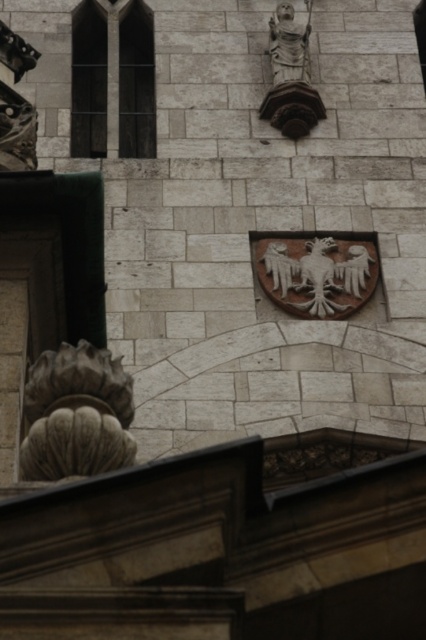
Consider the image. Between carved stone ornament at left and stone statue at upper center, which one is positioned lower?

Positioned lower is carved stone ornament at left.

Which is above, carved stone ornament at left or stone statue at upper center?

stone statue at upper center is higher up.

Image resolution: width=426 pixels, height=640 pixels. I want to click on carved stone ornament at left, so click(77, 413).

Can you confirm if carved stone ornament at left is smaller than brown stone shield at center?

No, carved stone ornament at left is not smaller than brown stone shield at center.

Does carved stone ornament at left have a larger size compared to brown stone shield at center?

Correct, carved stone ornament at left is larger in size than brown stone shield at center.

I want to click on carved stone ornament at left, so click(77, 413).

The image size is (426, 640). In order to click on carved stone ornament at left in this screenshot , I will do `click(77, 413)`.

Does point (327, 291) lie behind point (276, 83)?

No, (327, 291) is in front of (276, 83).

Between point (373, 262) and point (299, 77), which one is positioned behind?

The point (299, 77) is behind.

At what (x,y) coordinates should I click in order to perform the action: click on brown stone shield at center. Please return your answer as a coordinate pair (x, y). The width and height of the screenshot is (426, 640). Looking at the image, I should click on (316, 275).